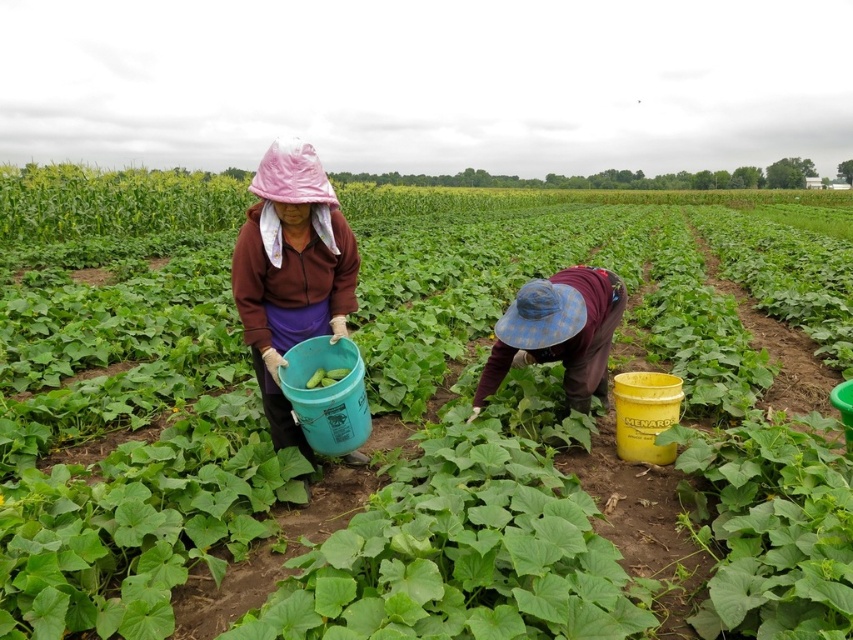
Question: Is matte brown jacket at center to the left of green matte cucumber at center from the viewer's perspective?

Choices:
 (A) yes
 (B) no

Answer: (A)

Question: Considering the relative positions of matte brown jacket at center and green matte cucumber at center in the image provided, where is matte brown jacket at center located with respect to green matte cucumber at center?

Choices:
 (A) right
 (B) left

Answer: (B)

Question: Which point is farther to the camera?

Choices:
 (A) green matte cucumber at center
 (B) matte brown jacket at center
 (C) green leafy plant at center

Answer: (A)

Question: Does green leafy plant at center have a smaller size compared to matte brown jacket at center?

Choices:
 (A) no
 (B) yes

Answer: (A)

Question: Which point is closer to the camera taking this photo?

Choices:
 (A) (320, 380)
 (B) (578, 385)

Answer: (A)

Question: Which of the following is the farthest from the observer?

Choices:
 (A) matte brown jacket at center
 (B) blue plaid hat at center

Answer: (B)